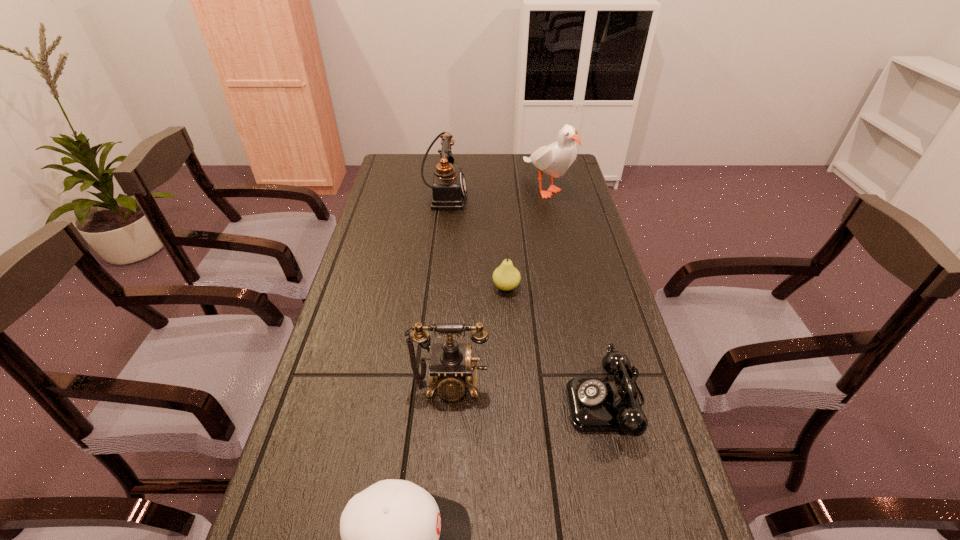
I want to click on vacant point located between the farthest telephone and the rightmost telephone, so click(526, 300).

Where is `empty space that is in between the farthest telephone and the rightmost telephone`? empty space that is in between the farthest telephone and the rightmost telephone is located at coordinates (526, 300).

The height and width of the screenshot is (540, 960). I want to click on vacant space in between the farthest telephone and the tallest object, so click(495, 192).

The image size is (960, 540). I want to click on free point between the gull and the shortest telephone, so click(x=577, y=295).

The height and width of the screenshot is (540, 960). I want to click on vacant area between the shortest telephone and the third object from right to left, so click(x=557, y=345).

I want to click on vacant area between the rightmost telephone and the tallest object, so point(577,295).

Locate an element on the screen. The width and height of the screenshot is (960, 540). the fourth closest object to the tallest object is located at coordinates (451, 370).

You are a GUI agent. You are given a task and a screenshot of the screen. Output one action in this format:
    pyautogui.click(x=<x>, y=<y>)
    Task: Click on the object that stands as the third closest to the farthest telephone
    The height and width of the screenshot is (540, 960).
    Given the screenshot: What is the action you would take?
    pyautogui.click(x=451, y=370)

Locate an element on the screen. This screenshot has width=960, height=540. telephone that is the closest to the shortest telephone is located at coordinates (451, 370).

This screenshot has width=960, height=540. In order to click on telephone that is the closest to the rightmost telephone in this screenshot , I will do `click(451, 370)`.